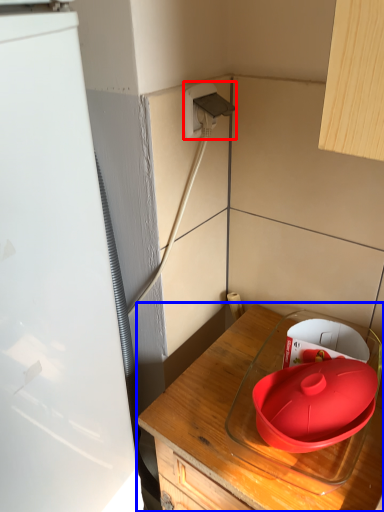
Question: Which point is further to the camera, electric outlet (highlighted by a red box) or countertop (highlighted by a blue box)?

Choices:
 (A) electric outlet
 (B) countertop

Answer: (A)